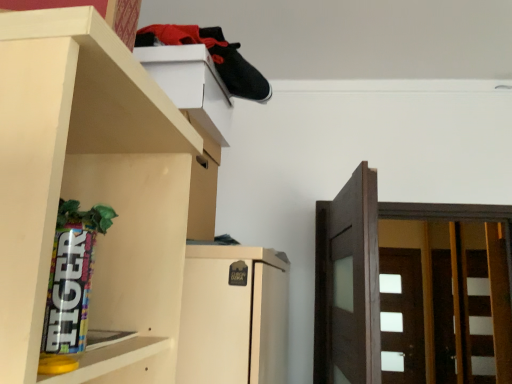
Question: Is dark brown wood door at right, the 1th door positioned from the front, shorter than white glossy door at right, which is the 1th door in back-to-front order?

Choices:
 (A) yes
 (B) no

Answer: (A)

Question: Is dark brown wood door at right, the 1th door positioned from the front, directly adjacent to white glossy door at right, which is the 1th door in back-to-front order?

Choices:
 (A) no
 (B) yes

Answer: (A)

Question: Does dark brown wood door at right, placed as the second door when sorted from back to front, have a greater width compared to white glossy door at right, arranged as the first door when ordered from the bottom?

Choices:
 (A) no
 (B) yes

Answer: (B)

Question: Can you confirm if dark brown wood door at right, which is the second door in bottom-to-top order, is taller than white glossy door at right, arranged as the first door when ordered from the bottom?

Choices:
 (A) no
 (B) yes

Answer: (A)

Question: Is dark brown wood door at right, the 1th door positioned from the front, smaller than white glossy door at right, marked as the 2th door in a top-to-bottom arrangement?

Choices:
 (A) no
 (B) yes

Answer: (A)

Question: Do you think white glossy door at right, marked as the 2th door in a top-to-bottom arrangement, is within dark brown wood door at right, which is the second door in bottom-to-top order, or outside of it?

Choices:
 (A) inside
 (B) outside

Answer: (B)

Question: From a real-world perspective, relative to dark brown wood door at right, arranged as the first door when viewed from the left, is white glossy door at right, which is the 1th door in back-to-front order, vertically above or below?

Choices:
 (A) below
 (B) above

Answer: (A)

Question: From the image's perspective, is white glossy door at right, which is the 1th door in back-to-front order, above or below dark brown wood door at right, the 1th door positioned from the front?

Choices:
 (A) above
 (B) below

Answer: (B)

Question: Relative to dark brown wood door at right, arranged as the first door when viewed from the left, is white glossy door at right, the first door when ordered from right to left, in front or behind?

Choices:
 (A) front
 (B) behind

Answer: (B)

Question: Is dark brown wood door at right, placed as the first door when sorted from top to bottom, taller or shorter than white matte cabinet at upper center?

Choices:
 (A) short
 (B) tall

Answer: (B)

Question: From the image's perspective, is dark brown wood door at right, placed as the second door when sorted from back to front, above or below white matte cabinet at upper center?

Choices:
 (A) below
 (B) above

Answer: (A)

Question: Is dark brown wood door at right, which ranks as the second door in right-to-left order, wider or thinner than white matte cabinet at upper center?

Choices:
 (A) thin
 (B) wide

Answer: (B)

Question: Choose the correct answer: Is dark brown wood door at right, placed as the second door when sorted from back to front, inside white matte cabinet at upper center or outside it?

Choices:
 (A) inside
 (B) outside

Answer: (B)

Question: From their relative heights in the image, would you say white glossy door at right, arranged as the first door when ordered from the bottom, is taller or shorter than white matte cabinet at upper center?

Choices:
 (A) tall
 (B) short

Answer: (A)

Question: Based on their positions, is white glossy door at right, which is the 1th door in back-to-front order, located to the left or right of white matte cabinet at upper center?

Choices:
 (A) right
 (B) left

Answer: (A)